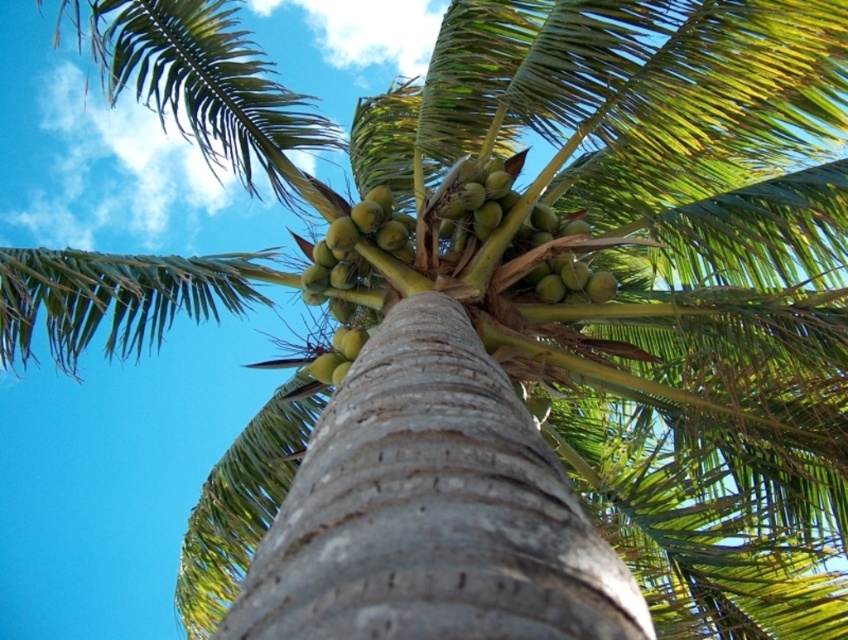
You are standing at the base of the coconut palm tree looking up. There is a point marked at coordinates (525, 250). What object is located at that point?

The point at (525, 250) indicates green matte coconuts at upper center.

You are standing at the base of the coconut palm tree and want to throw a small stone to hit the green matte coconuts at upper center. What are the coordinates you should aim for?

You should aim for the coordinates point (525,250) to hit the green matte coconuts at upper center.